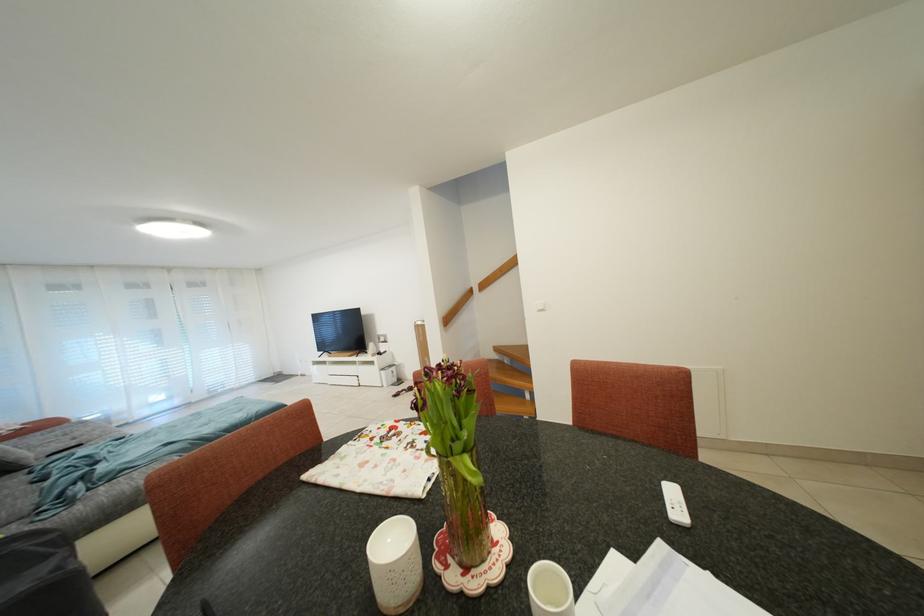
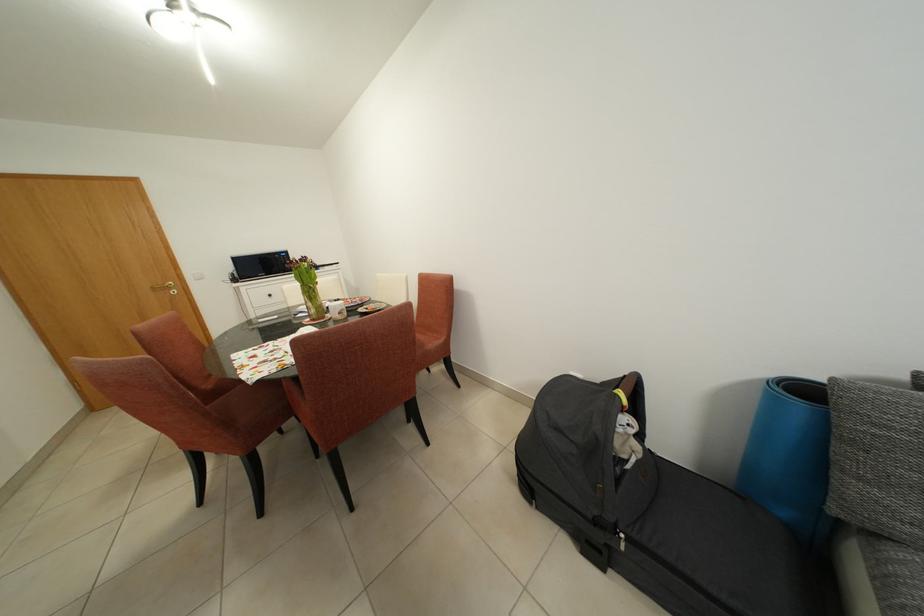
Where in the second image is the point corresponding to the point at 399,549 from the first image?

(345, 307)